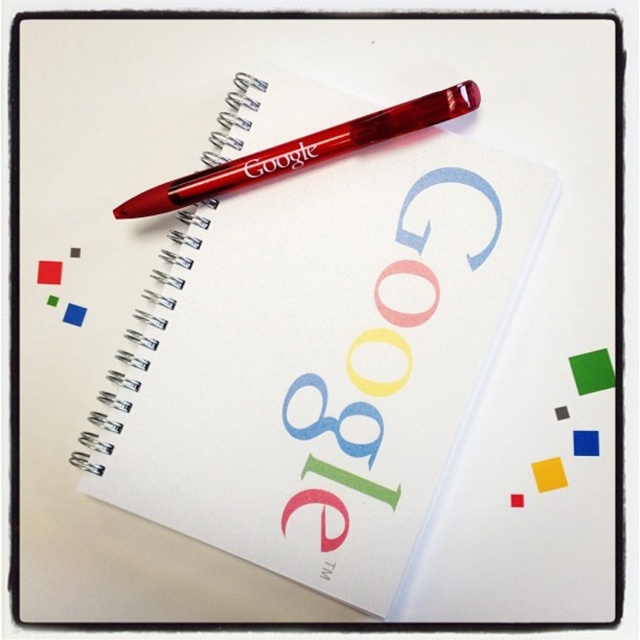
Question: Is transparent plastic notebook at center bigger than matte blue letter at center?

Choices:
 (A) no
 (B) yes

Answer: (B)

Question: Among these points, which one is nearest to the camera?

Choices:
 (A) (440, 104)
 (B) (312, 420)

Answer: (A)

Question: Which point is farther from the camera taking this photo?

Choices:
 (A) (451, 173)
 (B) (282, 420)
 (C) (248, 209)

Answer: (C)

Question: Observing the image, what is the correct spatial positioning of transparent plastic notebook at center in reference to transparent red pen at upper center?

Choices:
 (A) right
 (B) left

Answer: (A)

Question: Which point is farther to the camera?

Choices:
 (A) transparent red pen at upper center
 (B) smooth plastic g at center
 (C) matte blue letter at center
 (D) transparent plastic notebook at center

Answer: (C)

Question: Does matte blue letter at center appear on the left side of smooth plastic g at center?

Choices:
 (A) no
 (B) yes

Answer: (B)